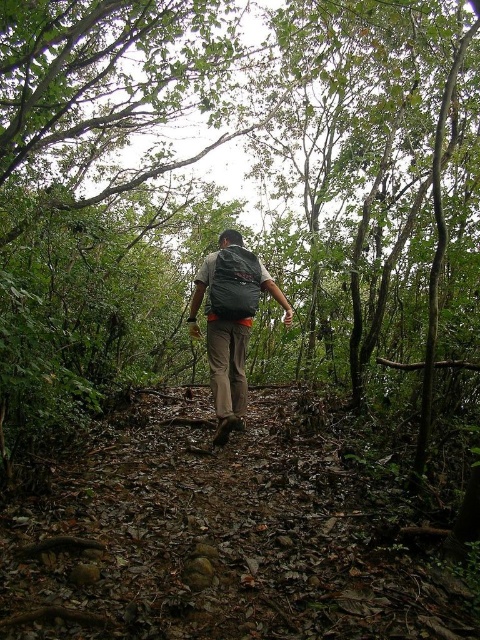
You are a hiker who wants to choose between the matte black backpack at center and the dark gray fabric backpack at center based on their sizes. Which backpack should you pick if you need more space for your gear?

The matte black backpack at center has a larger size compared to the dark gray fabric backpack at center, so you should pick the matte black backpack at center for more space.

You are a hiker who wants to adjust your backpack for better comfort. You have two backpacks on your back, the matte black backpack at center and the dark gray fabric backpack at center. Which one is positioned lower on your back?

The matte black backpack at center is located below the dark gray fabric backpack at center, so it is positioned lower on your back.

You are a hiker who wants to choose a backpack that can hold more items. You see two backpacks in front of you on the trail. Which backpack, the matte black backpack at center or the dark gray fabric backpack at center, can hold more items based on their size?

The matte black backpack at center is much taller than the dark gray fabric backpack at center, so it can hold more items.